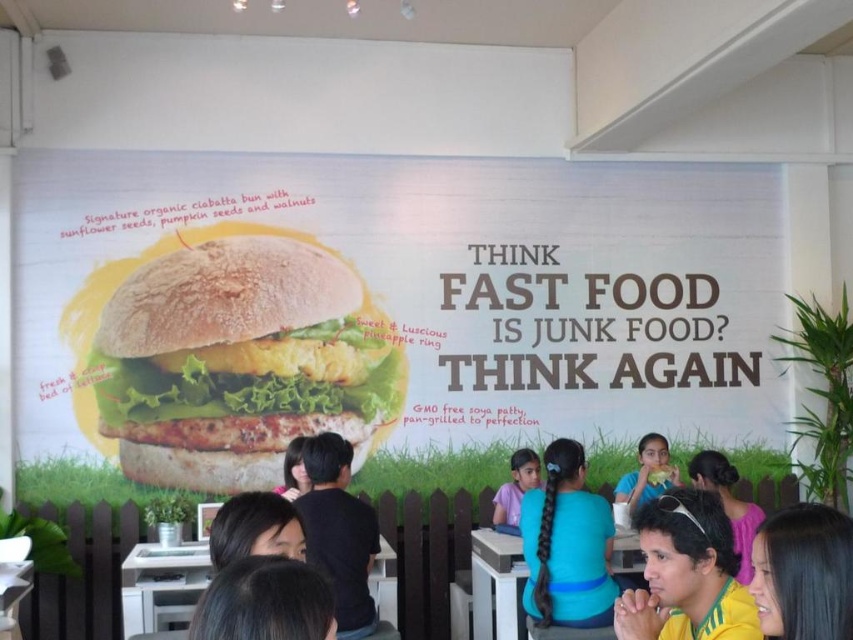
In the scene shown: Between matte white poster at center and golden brown bread at center, which one has more height?

matte white poster at center is taller.

Measure the distance between matte white poster at center and golden brown bread at center.

They are 27.62 inches apart.

This screenshot has height=640, width=853. What do you see at coordinates (381, 308) in the screenshot?
I see `matte white poster at center` at bounding box center [381, 308].

Find the location of a particular element. Image resolution: width=853 pixels, height=640 pixels. matte white poster at center is located at coordinates (381, 308).

Is black shirt at center positioned behind purple fabric shirt at lower center?

That is False.

Measure the distance from black shirt at center to purple fabric shirt at lower center.

1.52 meters

Where is `black shirt at center`? The width and height of the screenshot is (853, 640). black shirt at center is located at coordinates (338, 531).

Consider the image. Is black shirt at center closer to the viewer compared to white glossy table at center?

Yes, it is in front of white glossy table at center.

Is black shirt at center taller than white glossy table at center?

Indeed, black shirt at center has a greater height compared to white glossy table at center.

Locate an element on the screen. black shirt at center is located at coordinates (338, 531).

Where is `black shirt at center`? The width and height of the screenshot is (853, 640). black shirt at center is located at coordinates (338, 531).